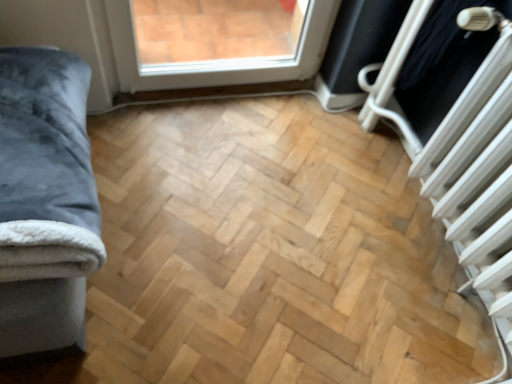
Question: Is white metallic radiator at right inside white plastic radiator at upper right?

Choices:
 (A) no
 (B) yes

Answer: (A)

Question: Can you confirm if white plastic radiator at upper right is shorter than white metallic radiator at right?

Choices:
 (A) yes
 (B) no

Answer: (A)

Question: Is white plastic radiator at upper right aimed at white metallic radiator at right?

Choices:
 (A) no
 (B) yes

Answer: (A)

Question: Considering the relative sizes of white plastic radiator at upper right and white metallic radiator at right in the image provided, is white plastic radiator at upper right wider than white metallic radiator at right?

Choices:
 (A) yes
 (B) no

Answer: (B)

Question: Is white plastic radiator at upper right smaller than white metallic radiator at right?

Choices:
 (A) no
 (B) yes

Answer: (B)

Question: Considering the positions of white plastic radiator at upper right and white metallic radiator at right in the image, is white plastic radiator at upper right bigger or smaller than white metallic radiator at right?

Choices:
 (A) big
 (B) small

Answer: (B)

Question: Is white plastic radiator at upper right situated inside white metallic radiator at right or outside?

Choices:
 (A) inside
 (B) outside

Answer: (B)

Question: Is white plastic radiator at upper right to the left or to the right of white metallic radiator at right in the image?

Choices:
 (A) left
 (B) right

Answer: (A)

Question: From a real-world perspective, relative to white metallic radiator at right, is white plastic radiator at upper right vertically above or below?

Choices:
 (A) above
 (B) below

Answer: (A)

Question: From a real-world perspective, is velvet grey blanket at left positioned above or below white plastic radiator at upper right?

Choices:
 (A) below
 (B) above

Answer: (A)

Question: Considering the positions of point (97, 261) and point (497, 72), is point (97, 261) closer or farther from the camera than point (497, 72)?

Choices:
 (A) closer
 (B) farther

Answer: (A)

Question: Looking at their shapes, would you say velvet grey blanket at left is wider or thinner than white plastic radiator at upper right?

Choices:
 (A) thin
 (B) wide

Answer: (B)

Question: Considering the positions of velvet grey blanket at left and white plastic radiator at upper right in the image, is velvet grey blanket at left taller or shorter than white plastic radiator at upper right?

Choices:
 (A) short
 (B) tall

Answer: (A)

Question: From a real-world perspective, is white metallic radiator at right above or below velvet grey blanket at left?

Choices:
 (A) above
 (B) below

Answer: (B)

Question: Is white metallic radiator at right taller or shorter than velvet grey blanket at left?

Choices:
 (A) tall
 (B) short

Answer: (A)